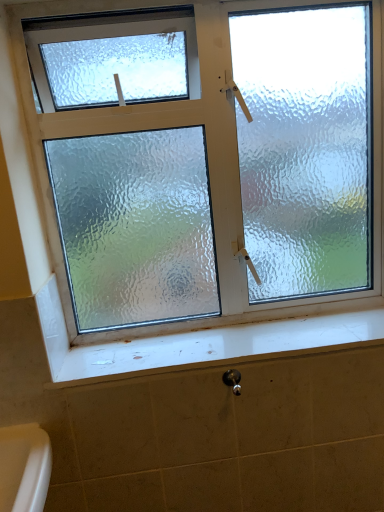
Describe the element at coordinates (200, 344) in the screenshot. I see `white glossy window sill at lower center` at that location.

The image size is (384, 512). I want to click on white glossy window sill at lower center, so [x=200, y=344].

The height and width of the screenshot is (512, 384). What do you see at coordinates (233, 380) in the screenshot?
I see `satin nickel shower at lower center` at bounding box center [233, 380].

I want to click on satin nickel shower at lower center, so click(233, 380).

In order to click on white glossy window sill at lower center in this screenshot , I will do `click(200, 344)`.

Does satin nickel shower at lower center appear on the left side of white glossy window sill at lower center?

Yes, satin nickel shower at lower center is to the left of white glossy window sill at lower center.

Does satin nickel shower at lower center come behind white glossy window sill at lower center?

No, satin nickel shower at lower center is in front of white glossy window sill at lower center.

Does point (233, 379) appear closer or farther from the camera than point (201, 339)?

Point (233, 379).

From the image's perspective, is satin nickel shower at lower center under white glossy window sill at lower center?

Yes, from the image's perspective, satin nickel shower at lower center is beneath white glossy window sill at lower center.

From a real-world perspective, is satin nickel shower at lower center over white glossy window sill at lower center?

Actually, satin nickel shower at lower center is physically below white glossy window sill at lower center in the real world.

Which of these two, satin nickel shower at lower center or white glossy window sill at lower center, is wider?

white glossy window sill at lower center.

Does satin nickel shower at lower center have a greater height compared to white glossy window sill at lower center?

Correct, satin nickel shower at lower center is much taller as white glossy window sill at lower center.

Looking at this image, who is bigger, satin nickel shower at lower center or white glossy window sill at lower center?

Bigger between the two is white glossy window sill at lower center.

Is satin nickel shower at lower center inside the boundaries of white glossy window sill at lower center, or outside?

satin nickel shower at lower center is spatially situated outside white glossy window sill at lower center.

Is there a large distance between satin nickel shower at lower center and white glossy window sill at lower center?

No, satin nickel shower at lower center is in close proximity to white glossy window sill at lower center.

Could you tell me if satin nickel shower at lower center is facing white glossy window sill at lower center?

No, satin nickel shower at lower center does not turn towards white glossy window sill at lower center.

How far apart are satin nickel shower at lower center and white glossy window sill at lower center?

satin nickel shower at lower center and white glossy window sill at lower center are 24.90 centimeters apart.

In order to click on shower that appears in front of the white glossy window sill at lower center in this screenshot , I will do coord(233,380).

Does white glossy window sill at lower center appear on the right side of satin nickel shower at lower center?

Correct, you'll find white glossy window sill at lower center to the right of satin nickel shower at lower center.

Between white glossy window sill at lower center and satin nickel shower at lower center, which one is positioned behind?

white glossy window sill at lower center is behind.

Is point (357, 316) in front of point (238, 378)?

That is False.

From the image's perspective, is white glossy window sill at lower center on satin nickel shower at lower center?

→ Indeed, from the image's perspective, white glossy window sill at lower center is shown above satin nickel shower at lower center.

From a real-world perspective, is white glossy window sill at lower center positioned over satin nickel shower at lower center based on gravity?

Yes, from a real-world perspective, white glossy window sill at lower center is on top of satin nickel shower at lower center.

Can you confirm if white glossy window sill at lower center is thinner than satin nickel shower at lower center?

Incorrect, the width of white glossy window sill at lower center is not less than that of satin nickel shower at lower center.

In the scene shown: Considering the sizes of objects white glossy window sill at lower center and satin nickel shower at lower center in the image provided, who is shorter, white glossy window sill at lower center or satin nickel shower at lower center?

white glossy window sill at lower center is shorter.

Looking at the image, does white glossy window sill at lower center seem bigger or smaller compared to satin nickel shower at lower center?

Clearly, white glossy window sill at lower center is larger in size than satin nickel shower at lower center.

Is satin nickel shower at lower center surrounded by white glossy window sill at lower center?

No, white glossy window sill at lower center does not contain satin nickel shower at lower center.

Are white glossy window sill at lower center and satin nickel shower at lower center located far from each other?

That's not correct — white glossy window sill at lower center is a little close to satin nickel shower at lower center.

Is white glossy window sill at lower center facing towards satin nickel shower at lower center?

No, white glossy window sill at lower center is not aimed at satin nickel shower at lower center.

How much distance is there between white glossy window sill at lower center and satin nickel shower at lower center?

9.80 inches.

Locate an element on the screen. The image size is (384, 512). shower lying in front of the white glossy window sill at lower center is located at coordinates (233, 380).

This screenshot has height=512, width=384. I want to click on shower below the white glossy window sill at lower center (from the image's perspective), so click(233, 380).

You are a GUI agent. You are given a task and a screenshot of the screen. Output one action in this format:
    pyautogui.click(x=<x>, y=<y>)
    Task: Click on the shower below the white glossy window sill at lower center (from a real-world perspective)
    This screenshot has width=384, height=512.
    Given the screenshot: What is the action you would take?
    pyautogui.click(x=233, y=380)